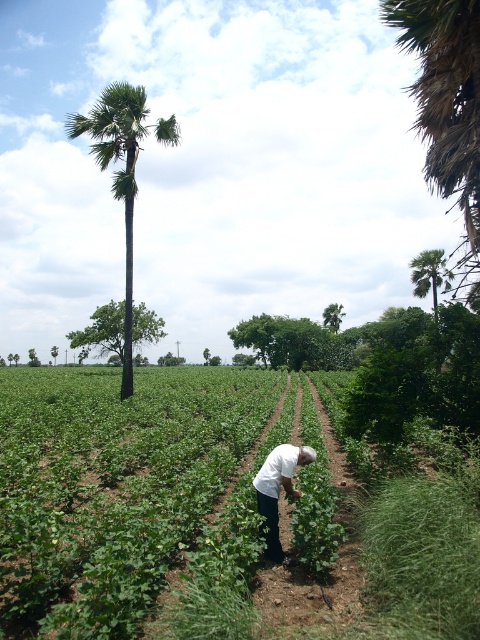
Question: Does green leafy plants at center appear over green leafy palm tree at right?

Choices:
 (A) no
 (B) yes

Answer: (A)

Question: Among these points, which one is farthest from the camera?

Choices:
 (A) (289, 488)
 (B) (435, 275)
 (C) (93, 326)

Answer: (C)

Question: Which point is farther to the camera?

Choices:
 (A) green leafy tree at center
 (B) green leafy palm tree at right

Answer: (A)

Question: Is green leafy palm at left to the right of white cotton shirt at center from the viewer's perspective?

Choices:
 (A) yes
 (B) no

Answer: (B)

Question: Which point is closer to the camera?

Choices:
 (A) (274, 486)
 (B) (93, 330)
 (C) (85, 116)
 (D) (424, 276)

Answer: (A)

Question: Can you confirm if green leafy plants at center is bigger than white cotton shirt at center?

Choices:
 (A) yes
 (B) no

Answer: (A)